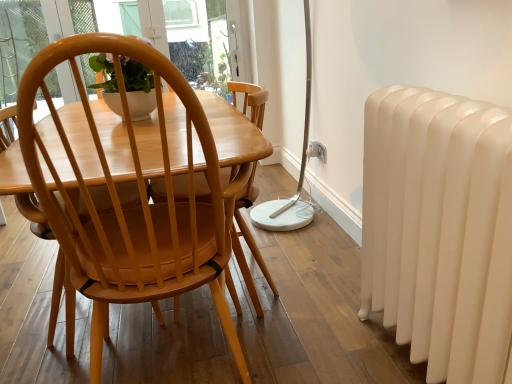
Locate an element on the screen. vacant area situated below matte wood chair at center (from a real-world perspective) is located at coordinates (180, 357).